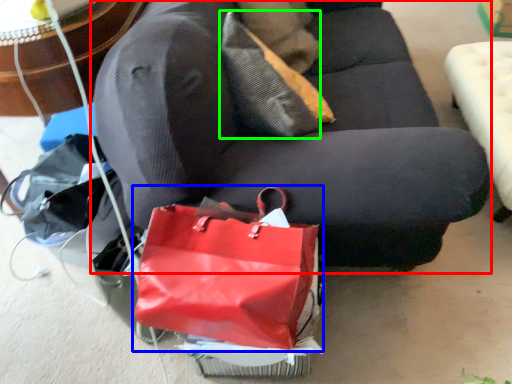
Question: Based on their relative distances, which object is nearer to studio couch (highlighted by a red box)? Choose from handbag (highlighted by a blue box) and pillow (highlighted by a green box).

Choices:
 (A) handbag
 (B) pillow

Answer: (B)